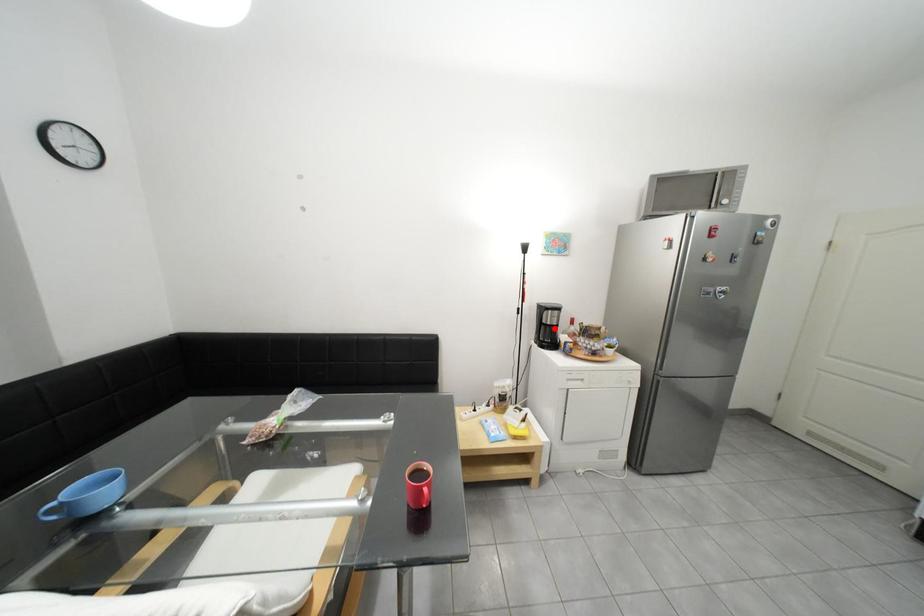
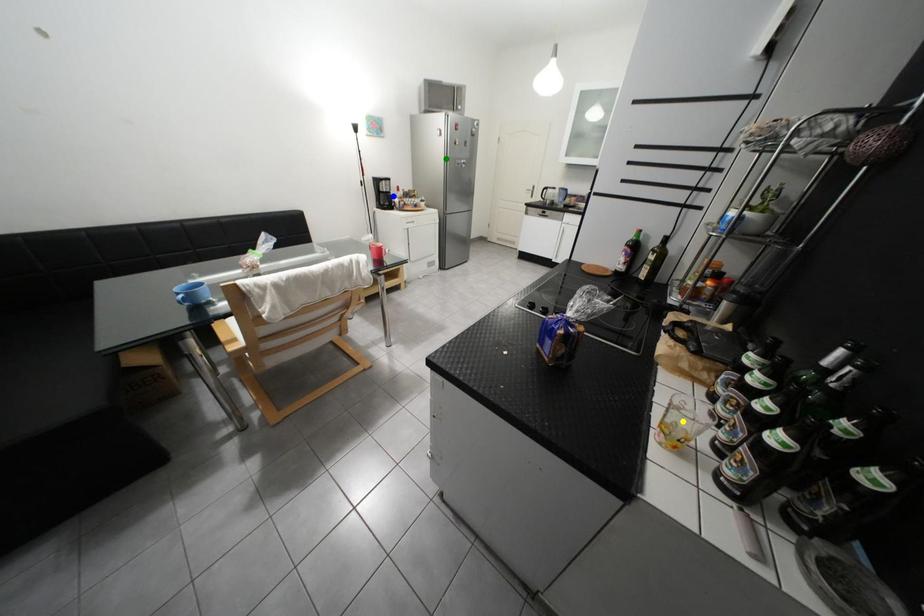
Question: I am providing you with two images of the same scene from different viewpoints. A red point is marked on the first image. You are given multiple points on the second image. Can you choose the point in image 2 that corresponds to the point in image 1?

Choices:
 (A) blue point
 (B) yellow point
 (C) green point

Answer: (A)